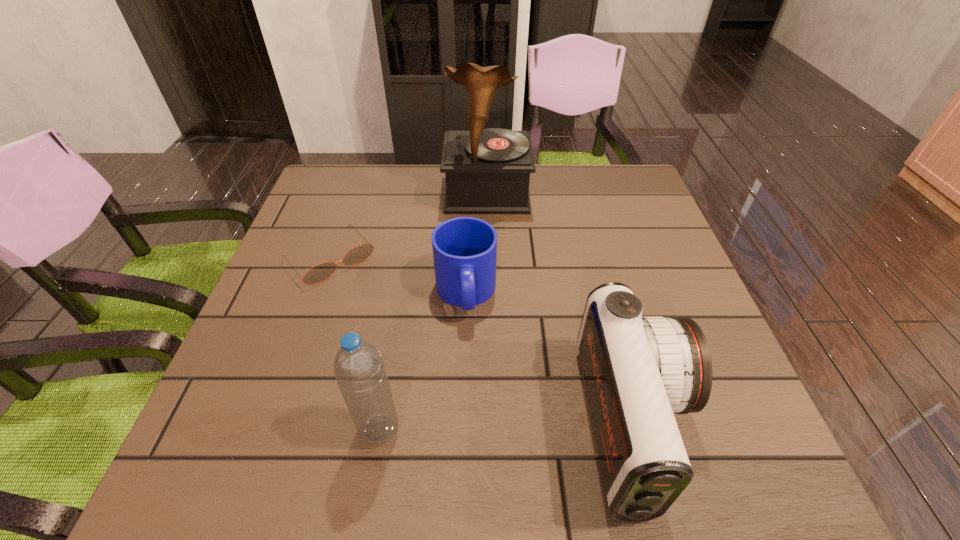
In order to click on water bottle in this screenshot , I will do `click(359, 369)`.

This screenshot has width=960, height=540. In order to click on the second object from left to right in this screenshot , I will do `click(359, 369)`.

Where is `the rightmost object`? The width and height of the screenshot is (960, 540). the rightmost object is located at coordinates (638, 370).

Image resolution: width=960 pixels, height=540 pixels. Identify the location of the third tallest object. (638, 370).

Find the location of a particular element. The image size is (960, 540). the shortest object is located at coordinates (319, 273).

Where is `sunglasses`? The image size is (960, 540). sunglasses is located at coordinates (319, 273).

I want to click on the tallest object, so click(487, 171).

In order to click on phonograph_record in this screenshot , I will do `click(487, 171)`.

The image size is (960, 540). I want to click on mug, so click(x=464, y=248).

Find the location of a particular element. The width and height of the screenshot is (960, 540). vacant area situated 0.260m on the back of the water bottle is located at coordinates (401, 302).